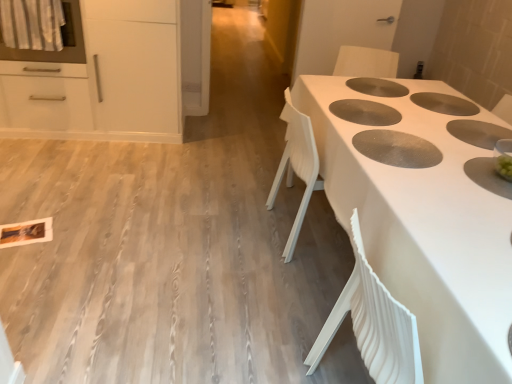
Question: Is white matte cabinet at upper left positioned beyond the bounds of white textured table at center?

Choices:
 (A) no
 (B) yes

Answer: (B)

Question: Is white matte cabinet at upper left aimed at white textured table at center?

Choices:
 (A) yes
 (B) no

Answer: (B)

Question: Is white matte cabinet at upper left further to camera compared to white textured table at center?

Choices:
 (A) no
 (B) yes

Answer: (B)

Question: Is white matte cabinet at upper left directly adjacent to white textured table at center?

Choices:
 (A) yes
 (B) no

Answer: (B)

Question: Can you confirm if white matte cabinet at upper left is shorter than white textured table at center?

Choices:
 (A) no
 (B) yes

Answer: (A)

Question: Is white matte cabinet at upper left to the right of white textured table at center from the viewer's perspective?

Choices:
 (A) yes
 (B) no

Answer: (B)

Question: From a real-world perspective, is white glossy oven at upper left positioned over white textured table at center based on gravity?

Choices:
 (A) yes
 (B) no

Answer: (A)

Question: Is white glossy oven at upper left facing towards white textured table at center?

Choices:
 (A) no
 (B) yes

Answer: (A)

Question: Can you confirm if white glossy oven at upper left is smaller than white textured table at center?

Choices:
 (A) yes
 (B) no

Answer: (A)

Question: Considering the relative sizes of white glossy oven at upper left and white textured table at center in the image provided, is white glossy oven at upper left thinner than white textured table at center?

Choices:
 (A) yes
 (B) no

Answer: (A)

Question: Is white glossy oven at upper left positioned with its back to white textured table at center?

Choices:
 (A) yes
 (B) no

Answer: (B)

Question: Considering the relative sizes of white glossy oven at upper left and white textured table at center in the image provided, is white glossy oven at upper left wider than white textured table at center?

Choices:
 (A) no
 (B) yes

Answer: (A)

Question: From a real-world perspective, is white matte cabinet at upper left physically below white glossy oven at upper left?

Choices:
 (A) no
 (B) yes

Answer: (B)